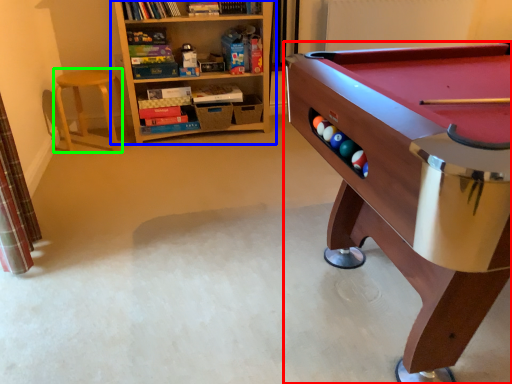
Question: Based on their relative distances, which object is nearer to table (highlighted by a red box)? Choose from bookcase (highlighted by a blue box) and stool (highlighted by a green box).

Choices:
 (A) bookcase
 (B) stool

Answer: (A)